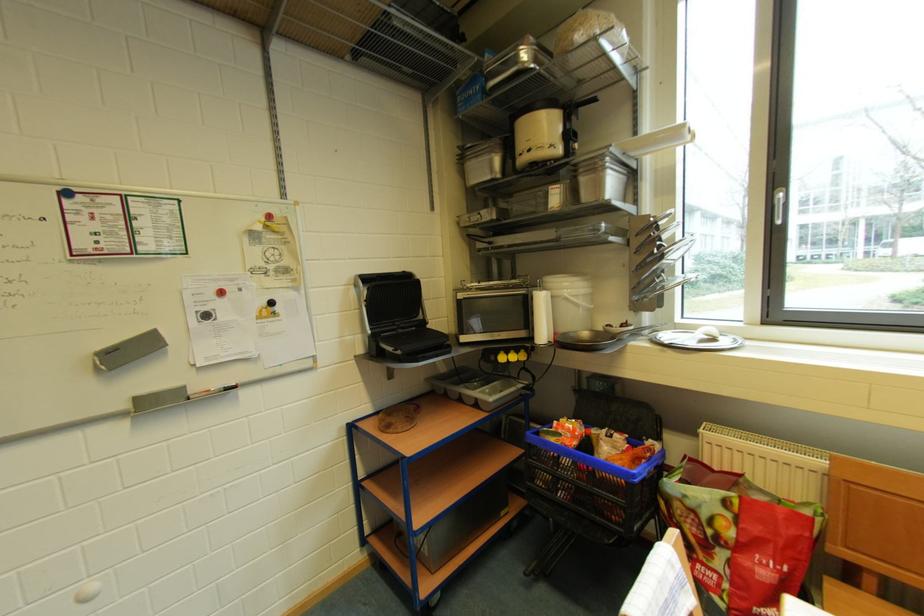
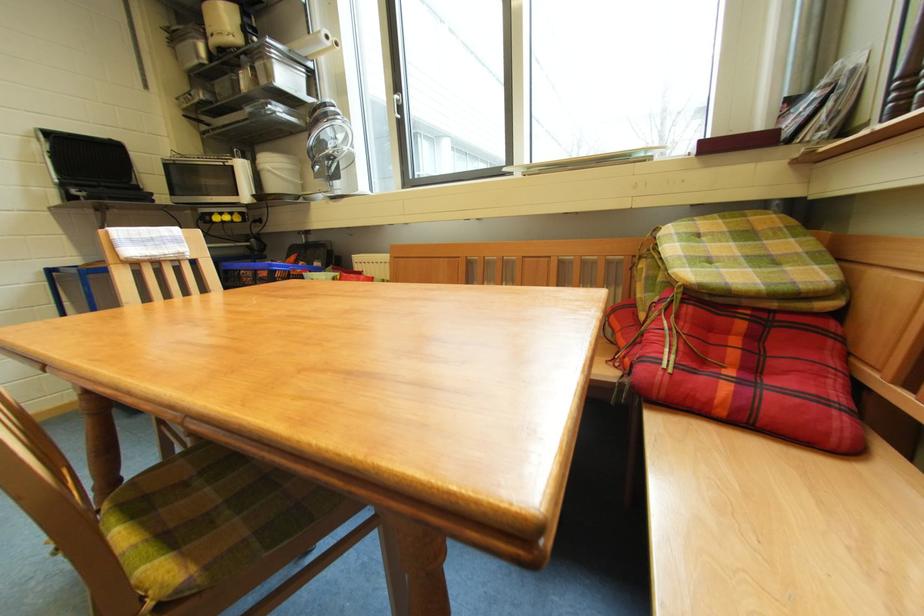
In the second image, find the point that corresponds to the point at 404,353 in the first image.

(88, 193)